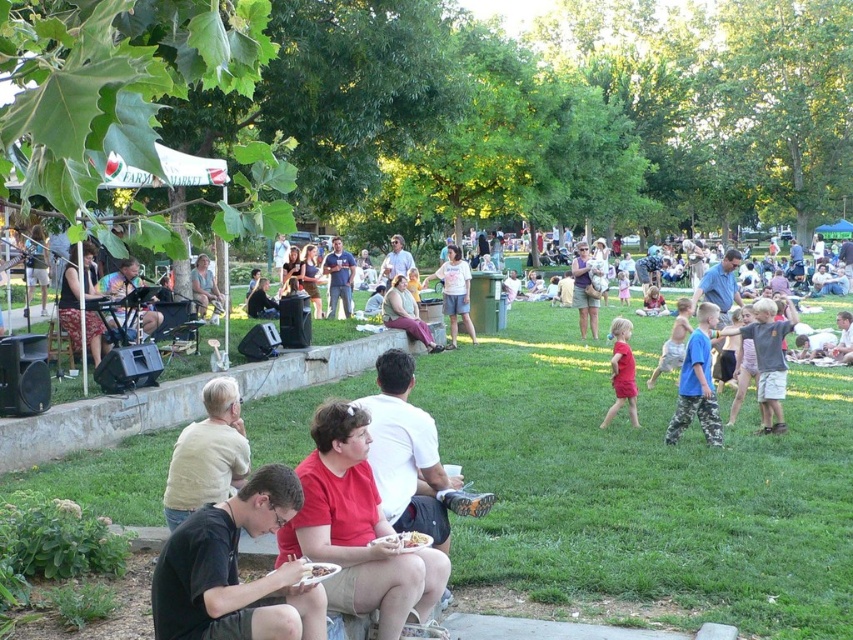
Question: Can you confirm if matte pink pants at center is positioned to the left of matte blue shirt at center?

Choices:
 (A) no
 (B) yes

Answer: (A)

Question: Estimate the real-world distances between objects in this image. Which object is farther from the red cotton shirt at center?

Choices:
 (A) matte brown purse at center
 (B) black t-shirt at lower left
 (C) blue camouflage pants at center-right
 (D) matte red shirt at center

Answer: (A)

Question: Considering the relative positions of matte pink pants at center and matte blue shirt at center in the image provided, where is matte pink pants at center located with respect to matte blue shirt at center?

Choices:
 (A) below
 (B) above

Answer: (A)

Question: Which object is positioned farthest from the matte black jacket at center?

Choices:
 (A) blue camouflage pants at center-right
 (B) matte black shirt at left
 (C) light beige sweater at lower left
 (D) gray cotton shirt at center-right

Answer: (C)

Question: Which of these objects is positioned farthest from the black t-shirt at lower left?

Choices:
 (A) white cotton shirt at center
 (B) matte brown purse at center
 (C) blue camouflage pants at center-right

Answer: (B)

Question: Is green grass at lower center closer to camera compared to red cotton shirt at center?

Choices:
 (A) yes
 (B) no

Answer: (B)